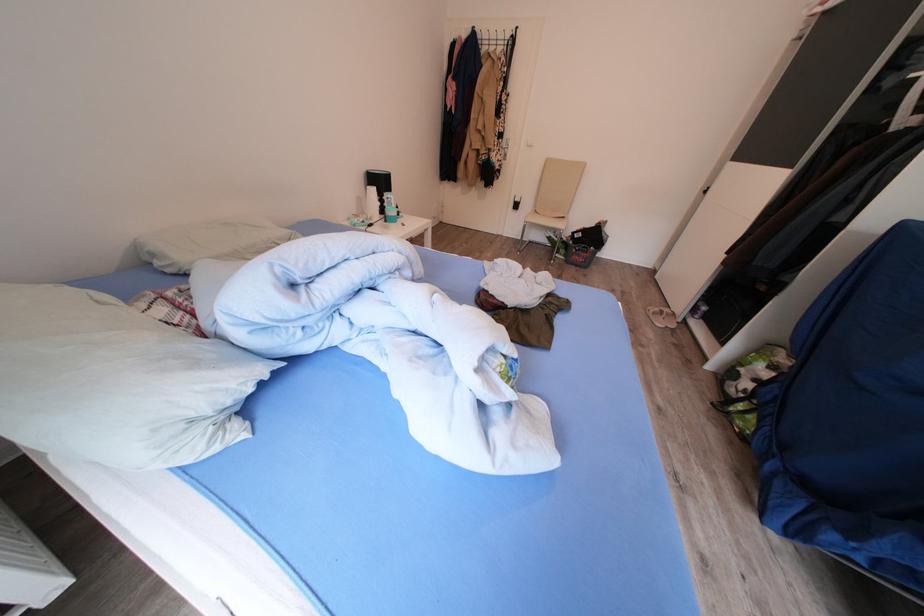
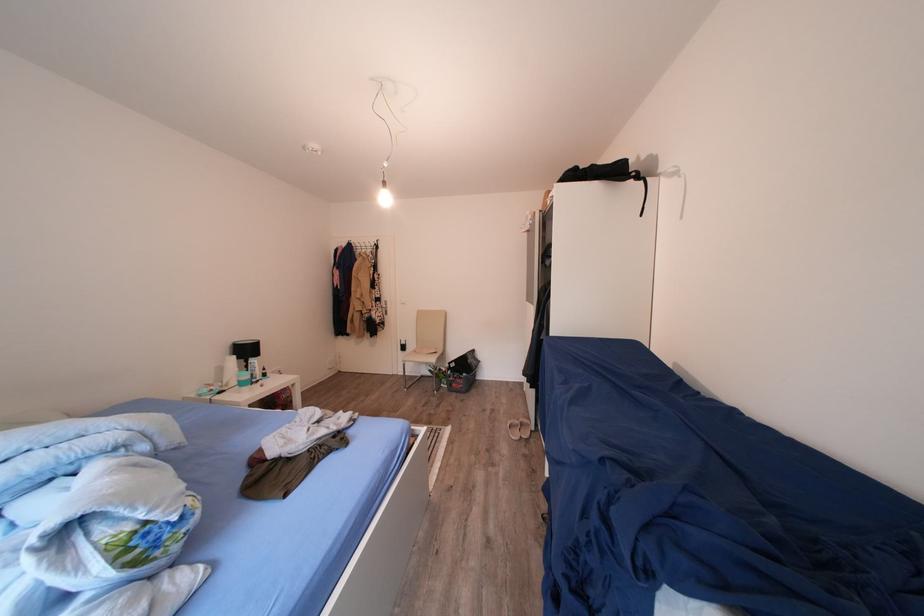
In the second image, find the point that corresponds to (525,211) in the first image.

(411, 353)